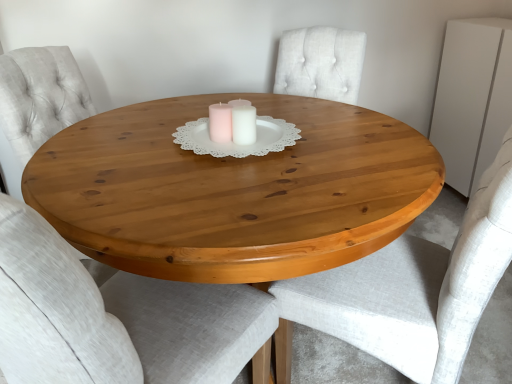
Question: From a real-world perspective, is light gray fabric chair at center, marked as the first chair in a left-to-right arrangement, located higher than white matte dresser at upper right?

Choices:
 (A) yes
 (B) no

Answer: (B)

Question: Is light gray fabric chair at center, marked as the first chair in a left-to-right arrangement, further to the viewer compared to white matte dresser at upper right?

Choices:
 (A) no
 (B) yes

Answer: (A)

Question: Considering the relative sizes of light gray fabric chair at center, marked as the first chair in a left-to-right arrangement, and white matte dresser at upper right in the image provided, is light gray fabric chair at center, marked as the first chair in a left-to-right arrangement, smaller than white matte dresser at upper right?

Choices:
 (A) yes
 (B) no

Answer: (B)

Question: Can you confirm if light gray fabric chair at center, arranged as the second chair when viewed from the right, is wider than white matte dresser at upper right?

Choices:
 (A) no
 (B) yes

Answer: (B)

Question: Is light gray fabric chair at center, marked as the first chair in a left-to-right arrangement, far from white matte dresser at upper right?

Choices:
 (A) no
 (B) yes

Answer: (B)

Question: Is white matte dresser at upper right spatially inside light gray fabric chair at center, marked as the first chair in a left-to-right arrangement, or outside of it?

Choices:
 (A) outside
 (B) inside

Answer: (A)

Question: From the image's perspective, is white matte dresser at upper right above or below light gray fabric chair at center, marked as the first chair in a left-to-right arrangement?

Choices:
 (A) below
 (B) above

Answer: (B)

Question: Considering the positions of white matte dresser at upper right and light gray fabric chair at center, marked as the first chair in a left-to-right arrangement, in the image, is white matte dresser at upper right bigger or smaller than light gray fabric chair at center, marked as the first chair in a left-to-right arrangement,?

Choices:
 (A) small
 (B) big

Answer: (A)

Question: From a real-world perspective, is white matte dresser at upper right above or below light gray fabric chair at center, arranged as the second chair when viewed from the right?

Choices:
 (A) above
 (B) below

Answer: (A)

Question: Considering the relative positions of white matte dresser at upper right and light gray fabric chair at right, arranged as the 1th chair when viewed from the right, in the image provided, is white matte dresser at upper right to the left or to the right of light gray fabric chair at right, arranged as the 1th chair when viewed from the right,?

Choices:
 (A) right
 (B) left

Answer: (A)

Question: Considering the positions of white matte dresser at upper right and light gray fabric chair at right, which is counted as the second chair, starting from the left, in the image, is white matte dresser at upper right bigger or smaller than light gray fabric chair at right, which is counted as the second chair, starting from the left,?

Choices:
 (A) small
 (B) big

Answer: (A)

Question: Looking at their shapes, would you say white matte dresser at upper right is wider or thinner than light gray fabric chair at right, which is counted as the second chair, starting from the left?

Choices:
 (A) wide
 (B) thin

Answer: (B)

Question: From the image's perspective, is white matte dresser at upper right above or below light gray fabric chair at right, which is counted as the second chair, starting from the left?

Choices:
 (A) below
 (B) above

Answer: (B)

Question: Does point (202, 148) appear closer or farther from the camera than point (288, 307)?

Choices:
 (A) closer
 (B) farther

Answer: (B)

Question: Choose the correct answer: Is white paper doily at center inside light gray fabric chair at right, which is counted as the second chair, starting from the left, or outside it?

Choices:
 (A) outside
 (B) inside

Answer: (A)